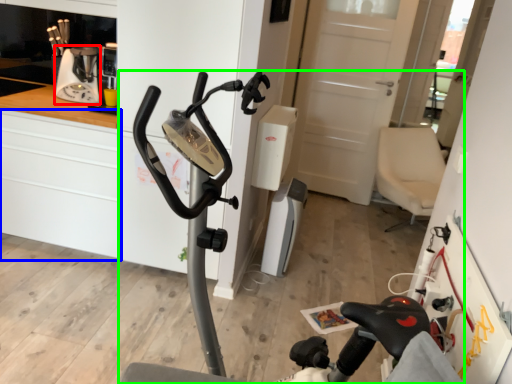
Question: Which object is the farthest from coffee machine (highlighted by a red box)? Choose among these: cabinetry (highlighted by a blue box) or stationary bicycle (highlighted by a green box).

Choices:
 (A) cabinetry
 (B) stationary bicycle

Answer: (B)